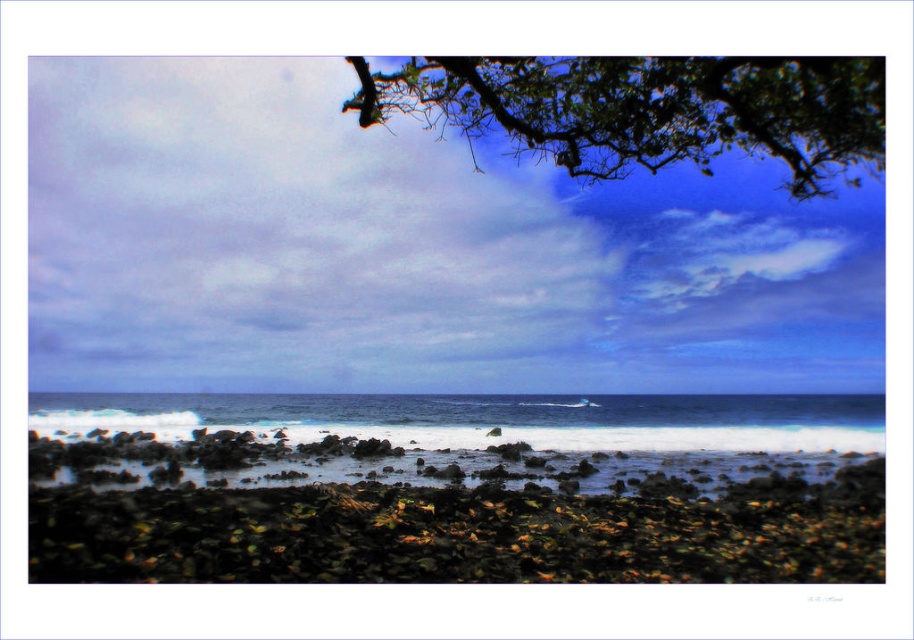
You are standing at the shoreline looking out at the ocean. There are two points marked in the image. One is at coordinates point (774, 413) and the other is at point (761, 97). Which point is closer to you?

Point (761, 97) is closer to you because it is not as far as point (774, 413), which is further away according to the description.

You are standing on the rocky shoreline and want to take a photo of the white frothy water at center and the green leafy tree at upper center. Which object should you point your camera towards first if you want to capture both in one frame?

You should point your camera towards the white frothy water at center first because it is positioned to the left of the green leafy tree at upper center, allowing both to be captured in the same frame.